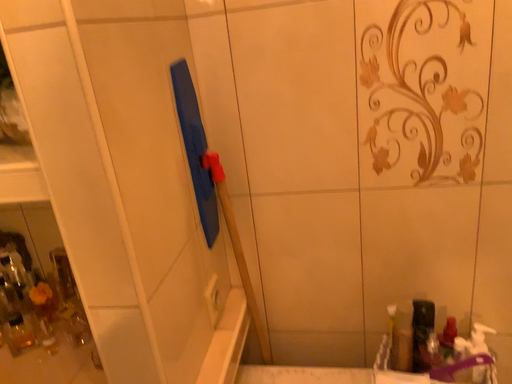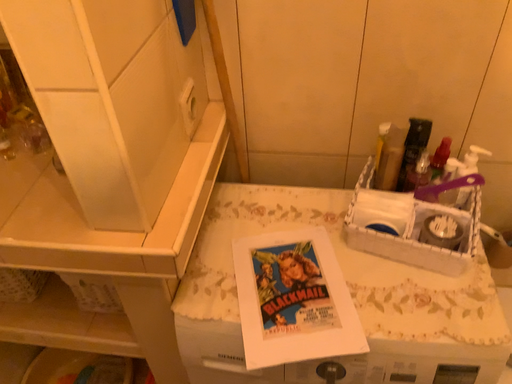
Question: How did the camera likely rotate when shooting the video?

Choices:
 (A) rotated downward
 (B) rotated upward

Answer: (A)